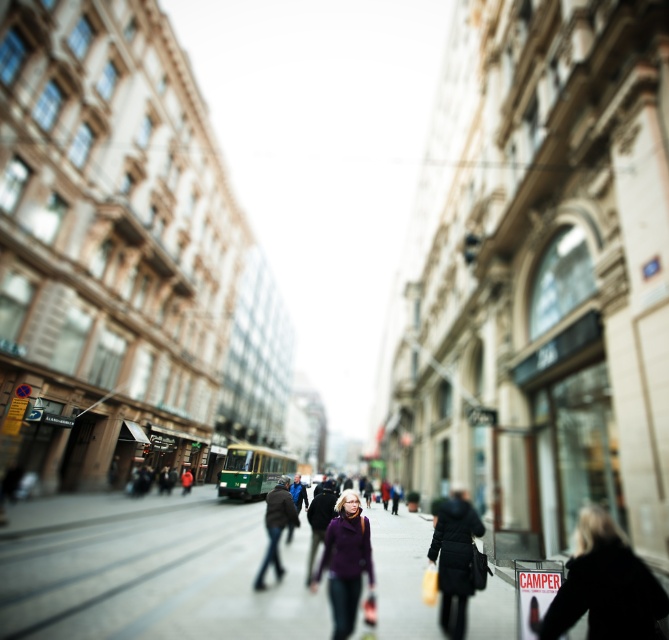
Question: Which point is farther from the camera taking this photo?

Choices:
 (A) (339, 628)
 (B) (551, 614)

Answer: (A)

Question: Is smooth concrete sidewalk at center positioned at the back of silhouette leather jacket at lower right?

Choices:
 (A) yes
 (B) no

Answer: (A)

Question: Which object is farther from the camera taking this photo?

Choices:
 (A) silhouette leather jacket at lower right
 (B) purple woolen sweater at center

Answer: (B)

Question: Among these points, which one is nearest to the camera?

Choices:
 (A) (545, 620)
 (B) (207, 541)

Answer: (A)

Question: Is smooth concrete sidewalk at center bigger than purple woolen sweater at center?

Choices:
 (A) no
 (B) yes

Answer: (B)

Question: Is silhouette leather jacket at lower right to the left of purple woolen sweater at center from the viewer's perspective?

Choices:
 (A) yes
 (B) no

Answer: (B)